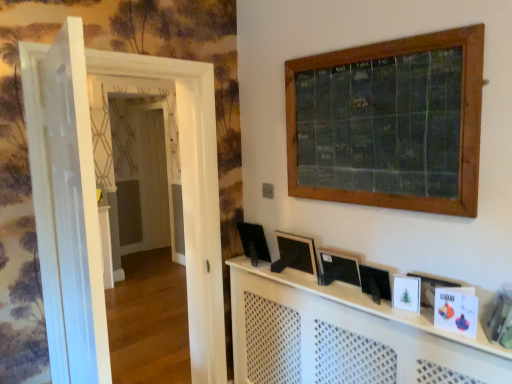
This screenshot has width=512, height=384. In order to click on free location in front of black matte picture frame at center, which is counted as the 1th picture frame, starting from the left in this screenshot , I will do (315, 283).